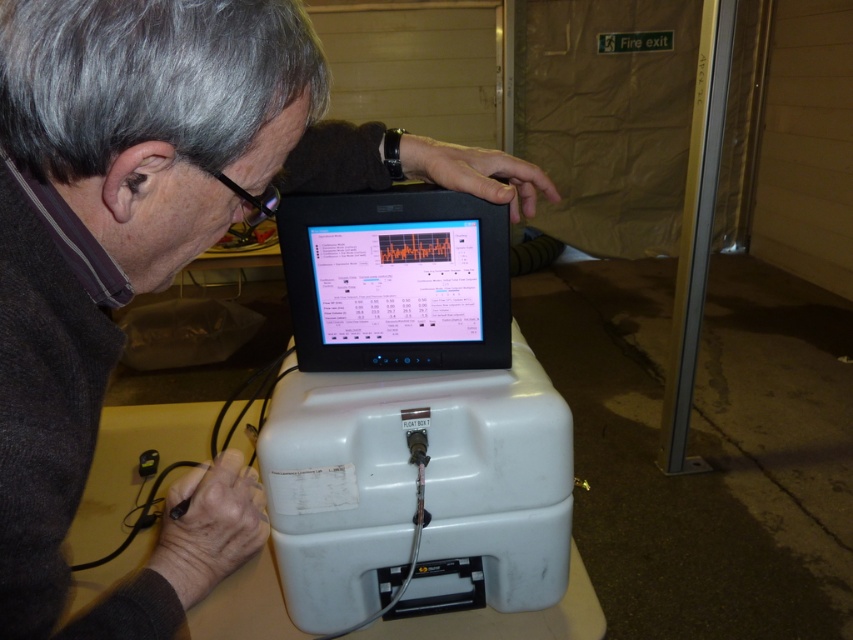
You are a technician standing 6 feet away from the equipment. The equipment has a point labeled as point [9,212]. If you want to reach this point with your hand, will you be able to do so without moving closer than 6 feet?

The point [9,212] is 16.75 inches away from the camera. Since you are standing 6 feet away from the equipment, which is 72 inches, the point is within your reach as it is closer than 6 feet.

What are the coordinates of the matte black monitor at center?

The matte black monitor at center is located at point (x=134, y=257).